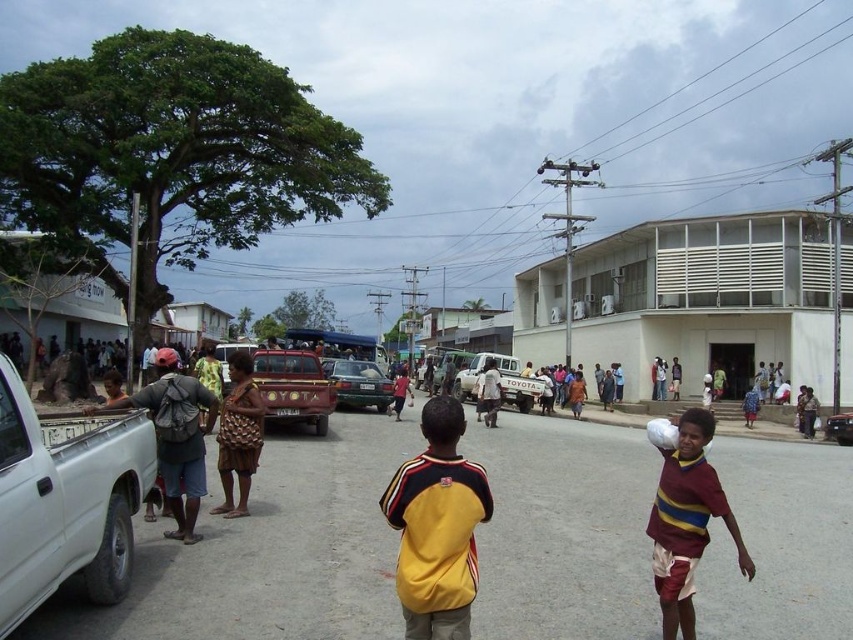
Does yellow striped shirt at center have a larger size compared to green matte car at center?

No.

Who is more forward, (453, 438) or (340, 358)?

Point (453, 438)

Between point (416, 572) and point (355, 376), which one is positioned in front?

Point (416, 572)

Identify the location of yellow striped shirt at center. (437, 525).

Locate an element on the screen. The image size is (853, 640). white matte pickup truck at left is located at coordinates (67, 499).

Between white matte pickup truck at left and maroon striped shirt at center, which one is positioned lower?

maroon striped shirt at center

Locate an element on the screen. This screenshot has height=640, width=853. white matte pickup truck at left is located at coordinates (67, 499).

Who is positioned more to the right, white matte pickup truck at left or yellow striped shirt at center?

yellow striped shirt at center

Which is below, white matte pickup truck at left or yellow striped shirt at center?

white matte pickup truck at left

Is point (38, 541) positioned behind point (410, 586)?

Yes, point (38, 541) is farther from viewer.

Locate an element on the screen. This screenshot has width=853, height=640. white matte pickup truck at left is located at coordinates (67, 499).